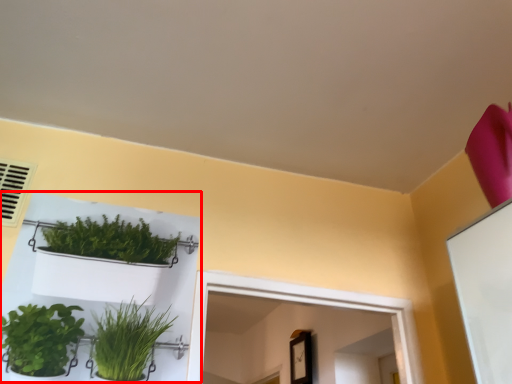
Question: From the image's perspective, what is the correct spatial positioning of shelf (annotated by the red box) in reference to air conditioning?

Choices:
 (A) below
 (B) above

Answer: (A)